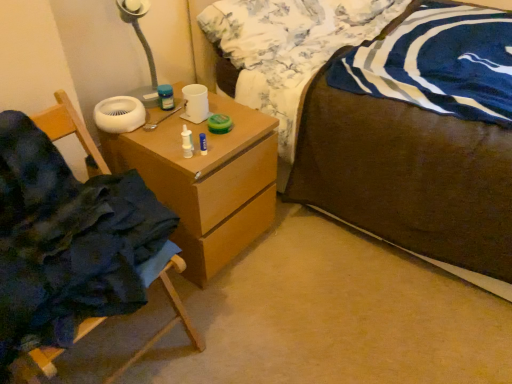
Where is `free space above wooden chest of drawers at center (from a real-world perspective)`? This screenshot has height=384, width=512. free space above wooden chest of drawers at center (from a real-world perspective) is located at coordinates (190, 126).